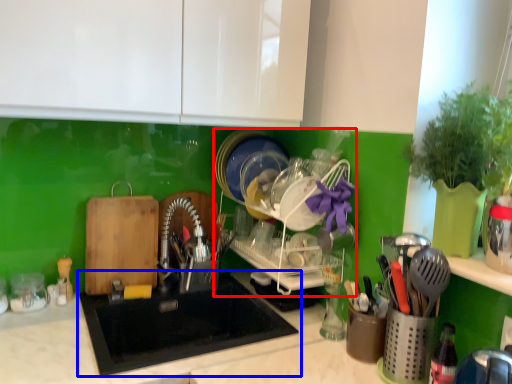
Question: Which object is closer to the camera taking this photo, dish washer (highlighted by a red box) or sink (highlighted by a blue box)?

Choices:
 (A) dish washer
 (B) sink

Answer: (B)